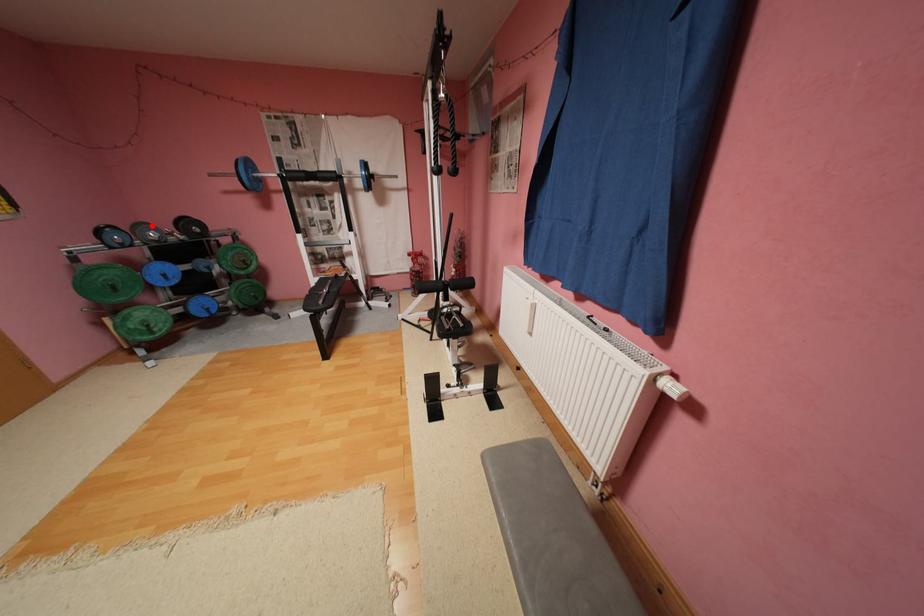
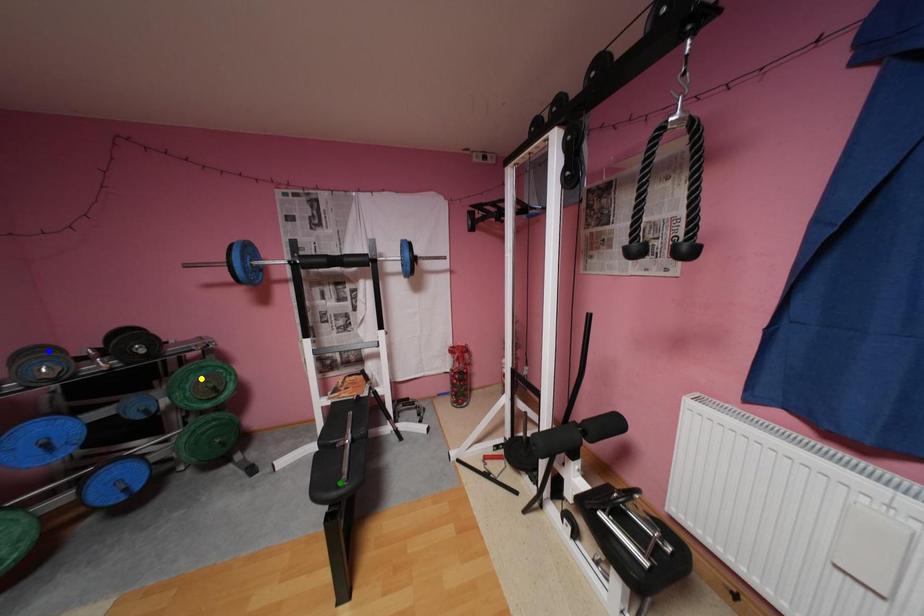
Question: I am providing you with two images of the same scene from different viewpoints. A red point is marked on the first image. You are given multiple points on the second image. In image 2, which mark is for the same physical point as the one in image 1?

Choices:
 (A) green point
 (B) blue point
 (C) yellow point

Answer: (B)